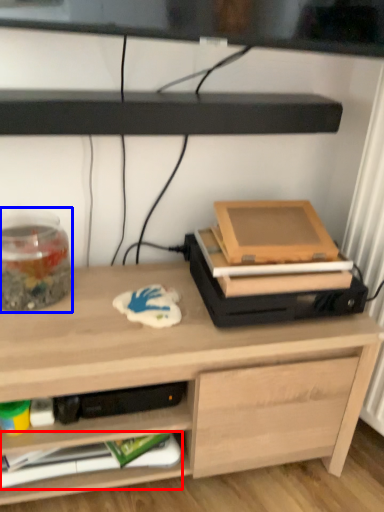
Question: Which object is further to the camera taking this photo, paperback book (highlighted by a red box) or glass jar (highlighted by a blue box)?

Choices:
 (A) paperback book
 (B) glass jar

Answer: (A)